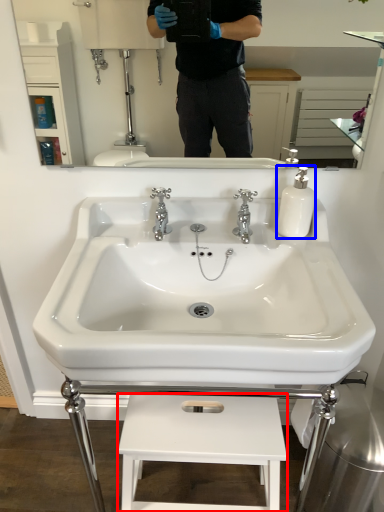
Question: Among these objects, which one is nearest to the camera, lift (highlighted by a red box) or soap dispenser (highlighted by a blue box)?

Choices:
 (A) lift
 (B) soap dispenser

Answer: (A)